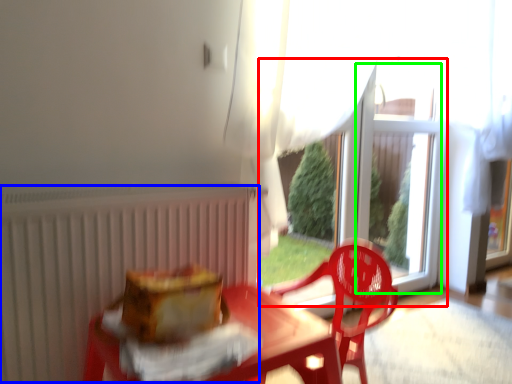
Question: Based on their relative distances, which object is nearer to glass door (highlighted by a red box)? Choose from radiator (highlighted by a blue box) and window screen (highlighted by a green box).

Choices:
 (A) radiator
 (B) window screen

Answer: (B)